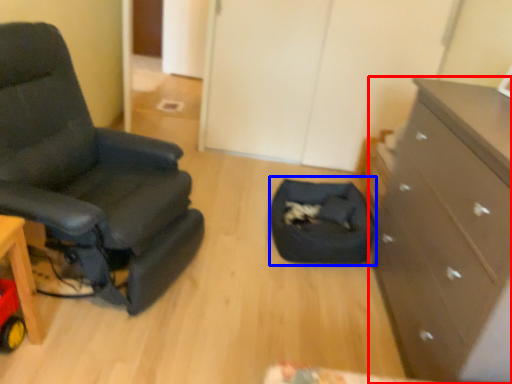
Question: Among these objects, which one is farthest to the camera, chest of drawers (highlighted by a red box) or footrest (highlighted by a blue box)?

Choices:
 (A) chest of drawers
 (B) footrest

Answer: (B)